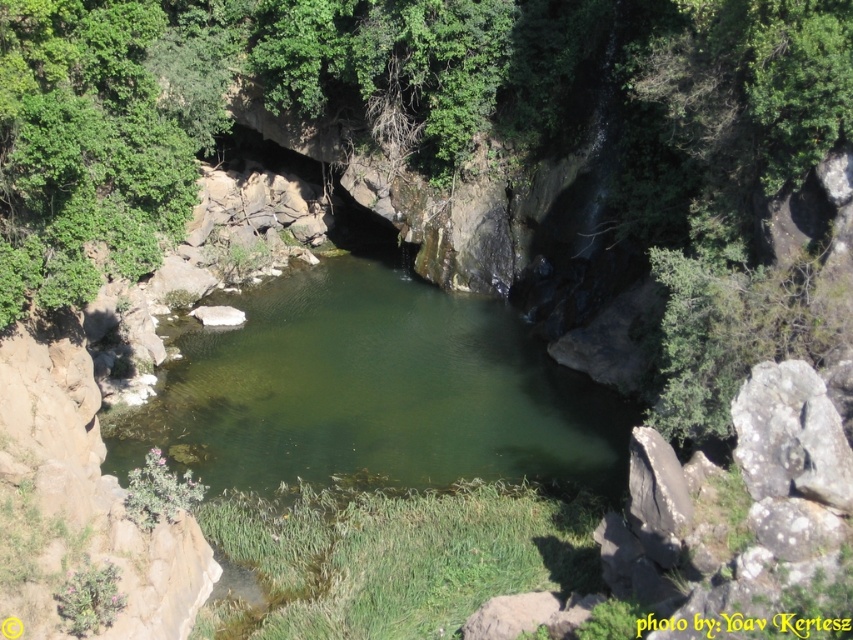
Between green smooth water at center and gray rough rock at right, which one has more height?

Standing taller between the two is green smooth water at center.

Is green smooth water at center shorter than gray rough rock at right?

In fact, green smooth water at center may be taller than gray rough rock at right.

Where is `green smooth water at center`? The height and width of the screenshot is (640, 853). green smooth water at center is located at coordinates (370, 392).

Is green smooth water at center above gray rough rock at lower right?

Yes, green smooth water at center is above gray rough rock at lower right.

Identify the location of green smooth water at center. This screenshot has height=640, width=853. (370, 392).

Measure the distance between gray rough rock at right and camera.

25.02 feet

Does gray rough rock at right have a lesser width compared to gray rough rock at lower right?

In fact, gray rough rock at right might be wider than gray rough rock at lower right.

Describe the element at coordinates (791, 435) in the screenshot. I see `gray rough rock at right` at that location.

Image resolution: width=853 pixels, height=640 pixels. What are the coordinates of `gray rough rock at right` in the screenshot? It's located at (791, 435).